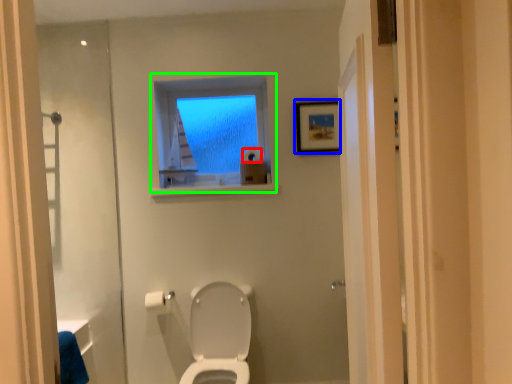
Question: Based on their relative distances, which object is nearer to toilet paper (highlighted by a red box)? Choose from picture frame (highlighted by a blue box) and window (highlighted by a green box).

Choices:
 (A) picture frame
 (B) window

Answer: (B)